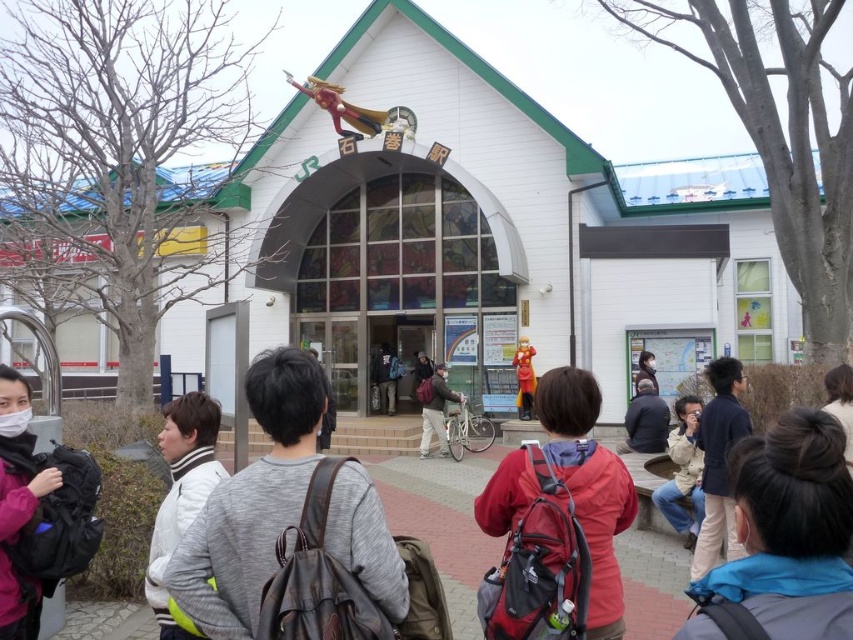
Question: Based on their relative distances, which object is nearer to the gray fabric backpacks at center?

Choices:
 (A) blue fabric jacket at lower right
 (B) light brown fabric jacket at lower right
 (C) red backpack at center
 (D) matte gray backpack at center

Answer: (C)

Question: Which object appears closest to the camera in this image?

Choices:
 (A) light brown fabric jacket at lower right
 (B) blue fabric jacket at lower right

Answer: (B)

Question: Is gray fabric backpacks at center in front of red backpack at center?

Choices:
 (A) yes
 (B) no

Answer: (A)

Question: Which point is farther from the camera taking this photo?

Choices:
 (A) (741, 582)
 (B) (219, 545)

Answer: (B)

Question: Does red backpack at center appear over white fleece jacket at lower left?

Choices:
 (A) yes
 (B) no

Answer: (A)

Question: Does gray fabric backpacks at center appear on the left side of white fleece jacket at lower left?

Choices:
 (A) yes
 (B) no

Answer: (B)